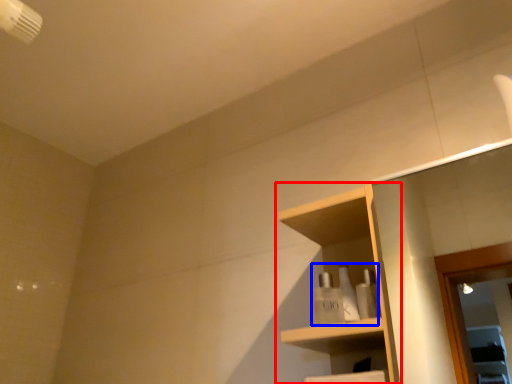
Question: Which object is closer to the camera taking this photo, shelf (highlighted by a red box) or toiletry (highlighted by a blue box)?

Choices:
 (A) shelf
 (B) toiletry

Answer: (A)